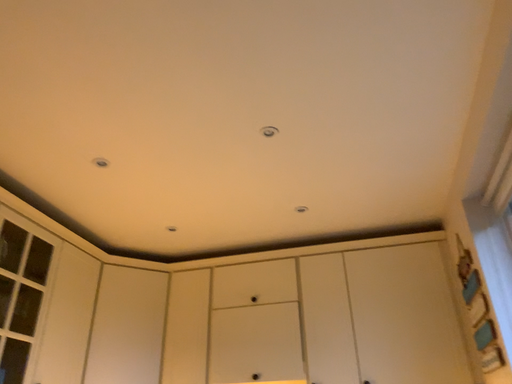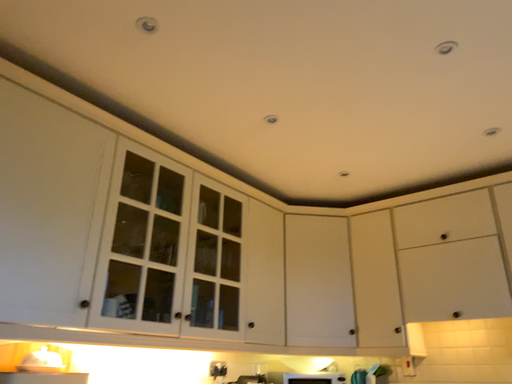
Question: Which way did the camera rotate in the video?

Choices:
 (A) rotated upward
 (B) rotated downward

Answer: (B)